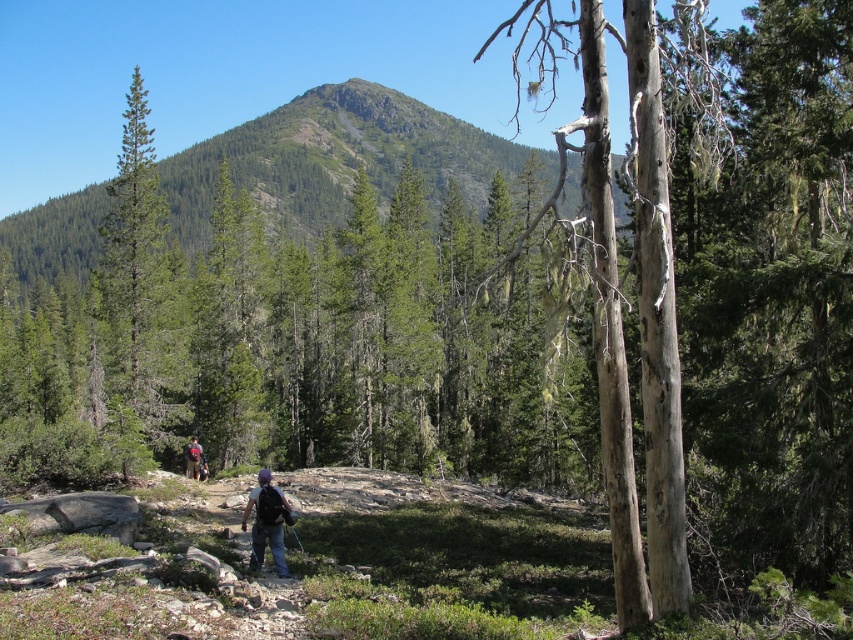
You are a hiker trying to locate your friend who is wearing dark blue jeans at center. According to the map, your current position is at point 0.817, 0.313. Which direction should you move to find them?

The dark blue jeans at center is located at point (265, 522), so you are already at the correct position to find them.

You are a hiker who wants to take a photo of the dark blue jeans at center. The green matte tree at left is blocking your view. Can you move to the right to get a clear shot?

The green matte tree at left is taller than dark blue jeans at center, so moving to the right might not help because the tree is still between you and the jeans. Try moving to the left instead.